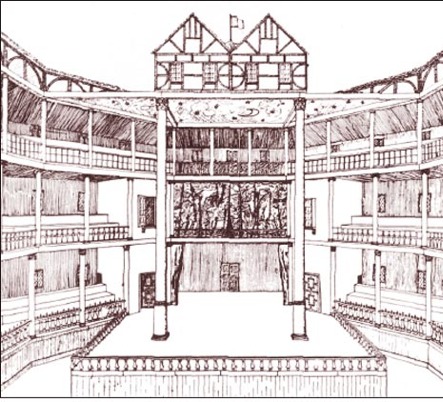
The image size is (443, 402). Identify the location of windows. (38, 279), (307, 214), (172, 73), (207, 69), (251, 80), (284, 74).